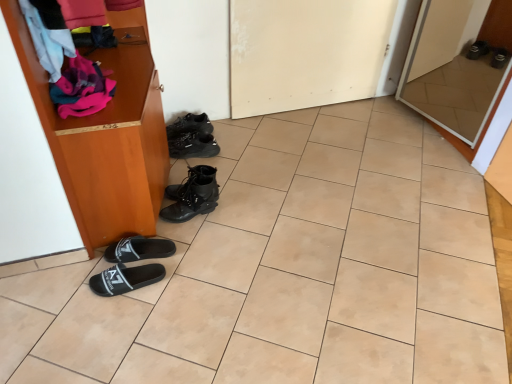
I want to click on vacant space to the right of black leather sneakers at center, which appears as the fifth footwear when viewed from the front, so click(221, 131).